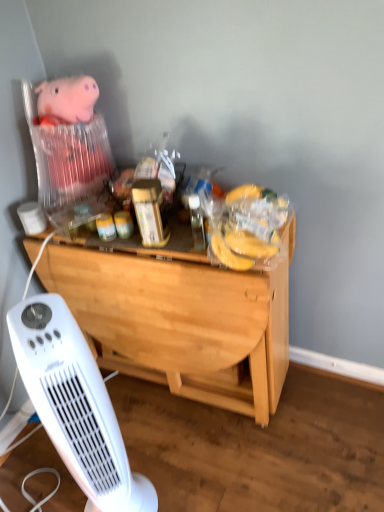
The image size is (384, 512). What do you see at coordinates (75, 404) in the screenshot?
I see `white plastic heater at lower left` at bounding box center [75, 404].

In order to face white plastic heater at lower left, should I rotate leftwards or rightwards?

It's best to rotate left around 13.858 degrees.

Where is `light wood desk at center`? This screenshot has width=384, height=512. light wood desk at center is located at coordinates (181, 321).

Find the location of a particular element. plush pink pig at upper left is located at coordinates (68, 140).

Does plush pink pig at upper left appear on the left side of light wood desk at center?

Correct, you'll find plush pink pig at upper left to the left of light wood desk at center.

Between plush pink pig at upper left and light wood desk at center, which one is positioned in front?

light wood desk at center is more forward.

Who is taller, plush pink pig at upper left or light wood desk at center?

With more height is light wood desk at center.

Considering the relative sizes of plush pink pig at upper left and light wood desk at center in the image provided, is plush pink pig at upper left smaller than light wood desk at center?

Yes.

Consider the image. From the image's perspective, which one is positioned higher, plush pink pig at upper left or white plastic heater at lower left?

plush pink pig at upper left appears higher in the image.

Is plush pink pig at upper left in front of or behind white plastic heater at lower left in the image?

In the image, plush pink pig at upper left appears behind white plastic heater at lower left.

The width and height of the screenshot is (384, 512). I want to click on home appliance below the plush pink pig at upper left (from the image's perspective), so click(x=75, y=404).

From a real-world perspective, is plush pink pig at upper left physically below white plastic heater at lower left?

No, from a real-world perspective, plush pink pig at upper left is not below white plastic heater at lower left.

Choose the correct answer: Is white plastic heater at lower left inside light wood desk at center or outside it?

white plastic heater at lower left is not enclosed by light wood desk at center.

Image resolution: width=384 pixels, height=512 pixels. Identify the location of desk that appears below the white plastic heater at lower left (from a real-world perspective). (181, 321).

From a real-world perspective, who is located lower, white plastic heater at lower left or light wood desk at center?

light wood desk at center, from a real-world perspective.

Would you say white plastic heater at lower left is outside plush pink pig at upper left?

white plastic heater at lower left is positioned outside plush pink pig at upper left.

How different are the orientations of white plastic heater at lower left and plush pink pig at upper left in degrees?

55.9 degrees.

Can you confirm if white plastic heater at lower left is smaller than plush pink pig at upper left?

No, white plastic heater at lower left is not smaller than plush pink pig at upper left.

From a real-world perspective, is white plastic heater at lower left above or below plush pink pig at upper left?

In terms of real-world spatial position, white plastic heater at lower left is below plush pink pig at upper left.

Between light wood desk at center and white plastic heater at lower left, which one is positioned in front?

white plastic heater at lower left is in front.

Considering the sizes of objects light wood desk at center and white plastic heater at lower left in the image provided, who is shorter, light wood desk at center or white plastic heater at lower left?

Standing shorter between the two is light wood desk at center.

Is light wood desk at center located outside white plastic heater at lower left?

Yes, light wood desk at center is outside of white plastic heater at lower left.

Is light wood desk at center positioned with its back to plush pink pig at upper left?

light wood desk at center is not turned away from plush pink pig at upper left.

Are light wood desk at center and plush pink pig at upper left far apart?

They are positioned close to each other.

From the image's perspective, between light wood desk at center and plush pink pig at upper left, which one is located above?

plush pink pig at upper left.

There is a light wood desk at center. At what (x,y) coordinates should I click in order to perform the action: click on toy above it (from a real-world perspective). Please return your answer as a coordinate pair (x, y). The width and height of the screenshot is (384, 512). Looking at the image, I should click on (68, 140).

I want to click on home appliance directly beneath the plush pink pig at upper left (from a real-world perspective), so click(x=75, y=404).

Which object lies nearer to the anchor point white plastic heater at lower left, plush pink pig at upper left or light wood desk at center?

light wood desk at center lies closer to white plastic heater at lower left than the other object.

Looking at the image, which one is located closer to plush pink pig at upper left, white plastic heater at lower left or light wood desk at center?

light wood desk at center lies closer to plush pink pig at upper left than the other object.

Based on their spatial positions, is plush pink pig at upper left or white plastic heater at lower left closer to light wood desk at center?

Based on the image, white plastic heater at lower left appears to be nearer to light wood desk at center.

Considering their positions, is light wood desk at center positioned closer to plush pink pig at upper left than white plastic heater at lower left?

Based on the image, light wood desk at center appears to be nearer to plush pink pig at upper left.

Estimate the real-world distances between objects in this image. Which object is further from light wood desk at center, white plastic heater at lower left or plush pink pig at upper left?

plush pink pig at upper left is positioned further to the anchor light wood desk at center.

Looking at the image, which one is located closer to white plastic heater at lower left, light wood desk at center or plush pink pig at upper left?

The object closer to white plastic heater at lower left is light wood desk at center.

Identify the location of desk between plush pink pig at upper left and white plastic heater at lower left in the up-down direction. This screenshot has width=384, height=512. (181, 321).